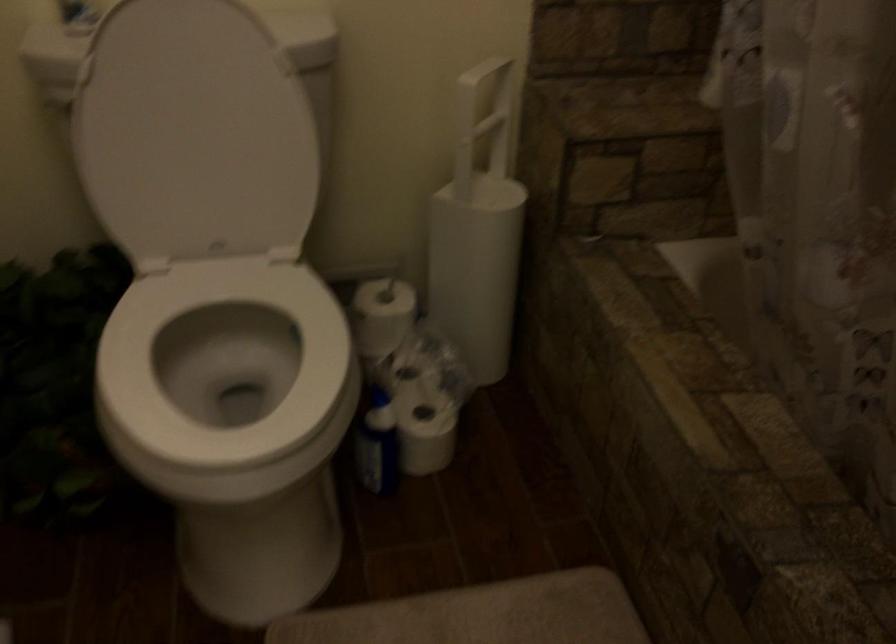
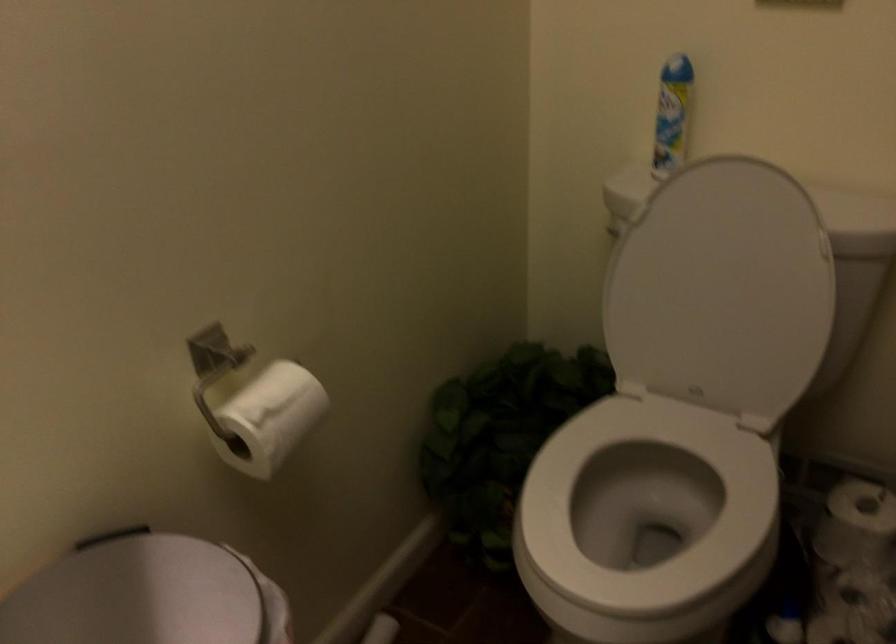
Locate, in the second image, the point that corresponds to [389,310] in the first image.

(856, 523)